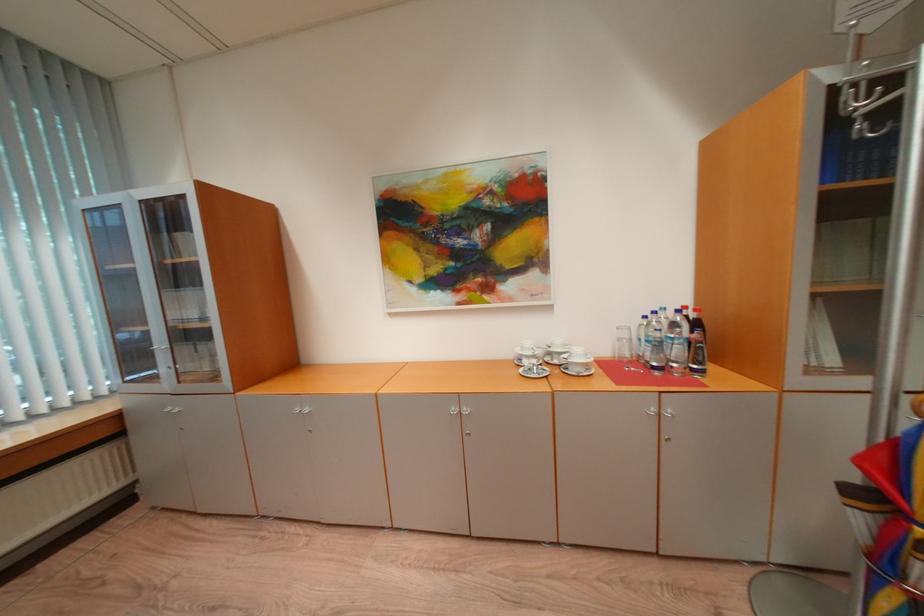
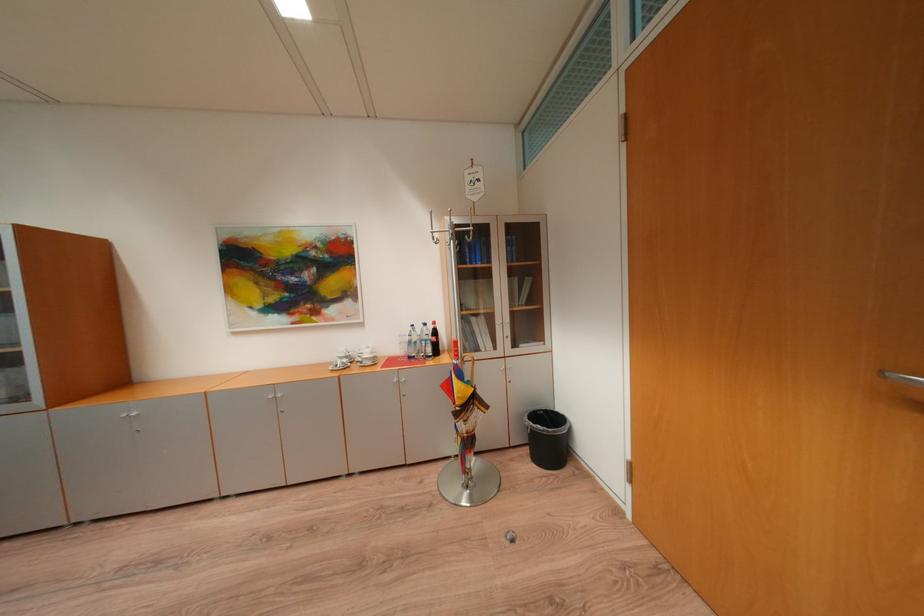
In the second image, find the point that corresponds to (542,358) in the first image.

(355, 359)